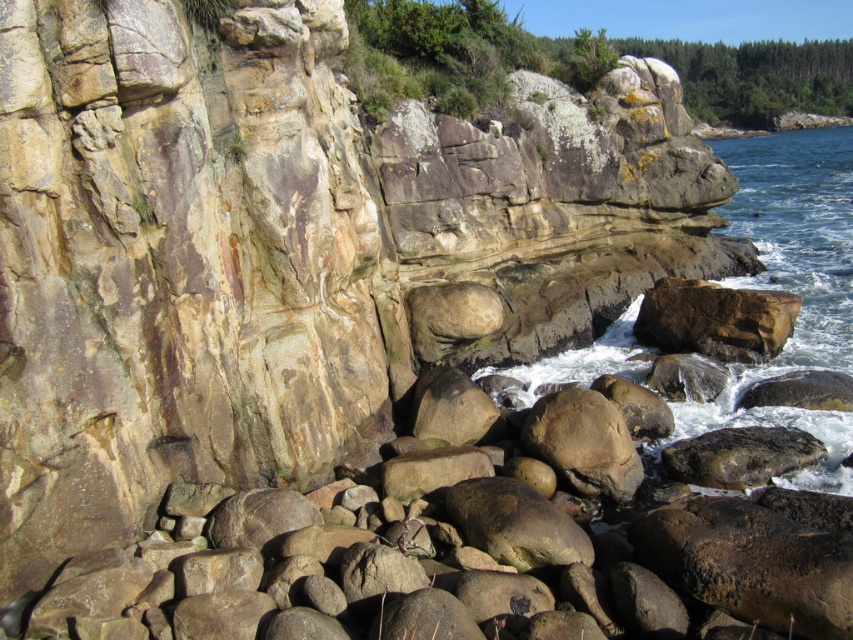
You are standing at the center of the coastal scene and want to reach the clear blue water at right. Based on the coordinates provided, is the water directly to your right or further ahead to your right?

The clear blue water at right is located at point coordinates, so it is directly to your right.

You are standing on the coastal path and see the clear blue water at right and the brown rough rock at center. Which one is higher in elevation?

The clear blue water at right is located above the brown rough rock at center, so it has a higher elevation.